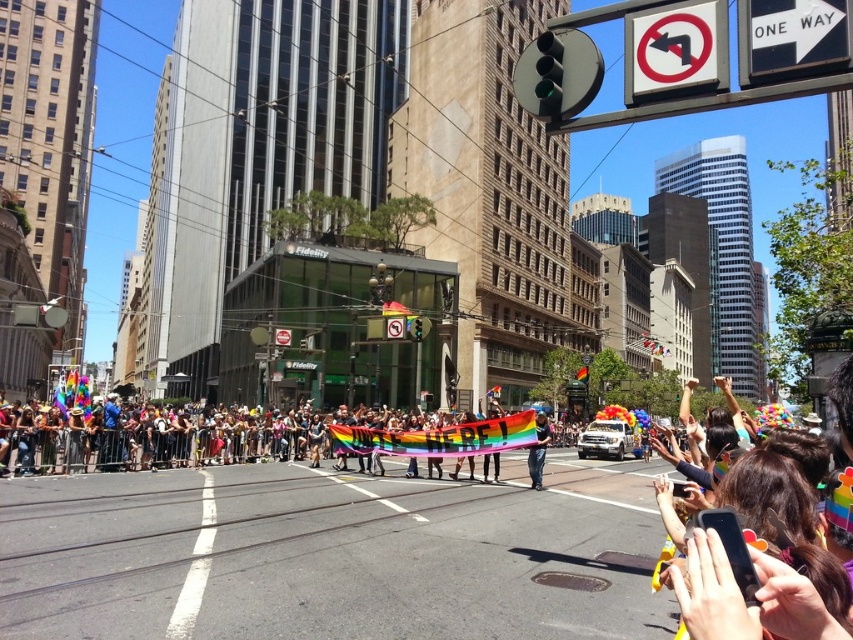
Question: Which of these objects is positioned closest to the rainbow flag at center?

Choices:
 (A) multicolored hair at center
 (B) rainbow fabric banner at center

Answer: (B)

Question: Is the position of rainbow fabric banner at center more distant than that of rainbow flag at center?

Choices:
 (A) yes
 (B) no

Answer: (B)

Question: Which object is the closest to the multicolored hair at center?

Choices:
 (A) rainbow flag at center
 (B) rainbow fabric banner at center

Answer: (A)

Question: Which object appears closest to the camera in this image?

Choices:
 (A) rainbow fabric banner at center
 (B) rainbow flag at center
 (C) multicolored hair at center

Answer: (C)

Question: Can you confirm if rainbow fabric banner at center is thinner than rainbow flag at center?

Choices:
 (A) yes
 (B) no

Answer: (B)

Question: Does rainbow fabric banner at center appear on the right side of multicolored hair at center?

Choices:
 (A) yes
 (B) no

Answer: (B)